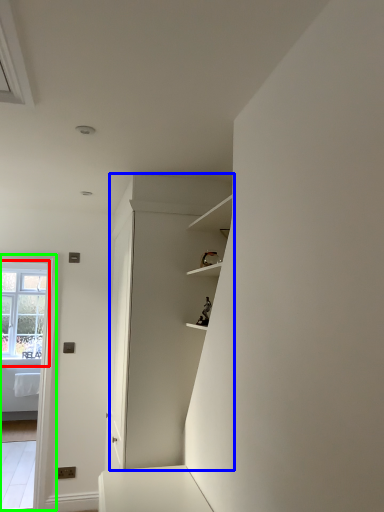
Question: Which object is the farthest from window (highlighted by a red box)? Choose among these: dresser (highlighted by a blue box) or glass door (highlighted by a green box).

Choices:
 (A) dresser
 (B) glass door

Answer: (A)